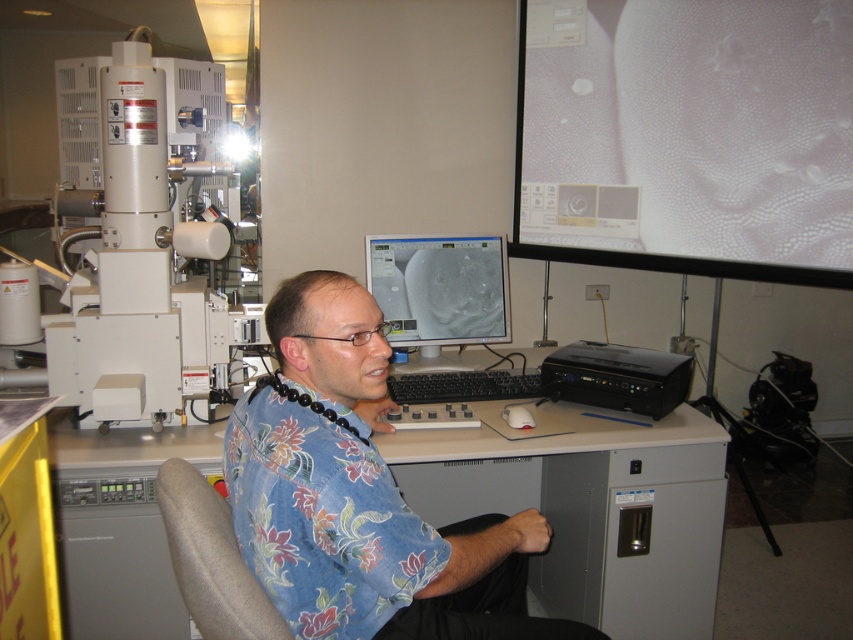
Question: Which object is closer to the camera taking this photo?

Choices:
 (A) gray matte computer desk at center
 (B) matte gray monitor at center

Answer: (A)

Question: Which point is closer to the camera taking this photo?

Choices:
 (A) (683, 636)
 (B) (432, 600)
 (C) (820, 216)
 (D) (393, 360)

Answer: (B)

Question: Is gray matte computer desk at center behind gray fabric chair at center?

Choices:
 (A) no
 (B) yes

Answer: (B)

Question: Is white matte projection screen at upper right to the left of gray matte computer desk at center from the viewer's perspective?

Choices:
 (A) yes
 (B) no

Answer: (B)

Question: Which object appears closest to the camera in this image?

Choices:
 (A) gray fabric chair at center
 (B) white matte projection screen at upper right
 (C) matte gray monitor at center
 (D) blue floral shirt at center

Answer: (A)

Question: Is white matte projection screen at upper right above blue floral shirt at center?

Choices:
 (A) no
 (B) yes

Answer: (B)